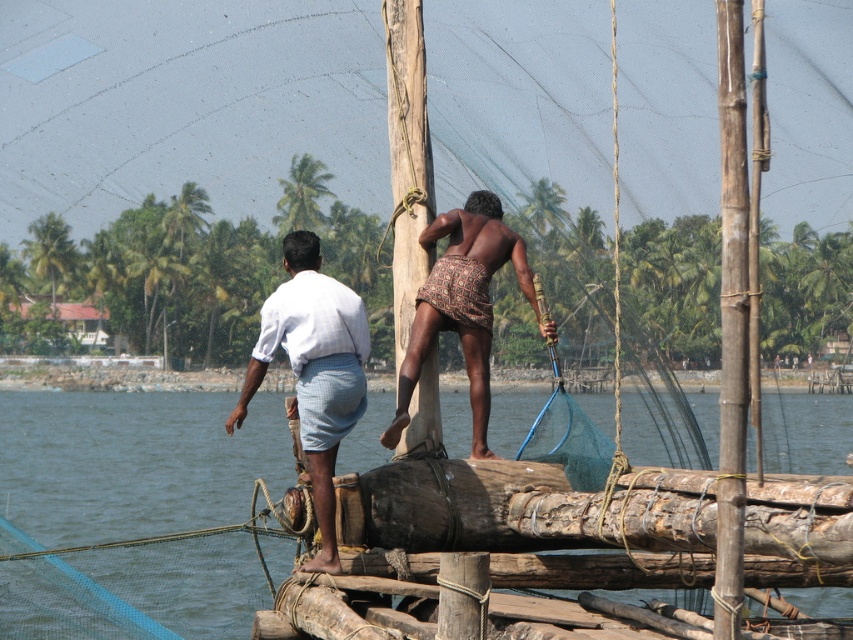
Question: Does transparent blue water at center have a greater width compared to brown woven cloth at center?

Choices:
 (A) no
 (B) yes

Answer: (B)

Question: Which point is farther to the camera?

Choices:
 (A) transparent blue water at center
 (B) brown woven cloth at center
 (C) brown bamboo pole at center

Answer: (A)

Question: Which of the following is the farthest from the observer?

Choices:
 (A) white checkered cloth at center
 (B) transparent blue water at center
 (C) brown bamboo pole at center

Answer: (B)

Question: Which of the following is the farthest from the observer?

Choices:
 (A) brown bamboo pole at center
 (B) white checkered cloth at center
 (C) transparent blue water at center
 (D) patterned fabric shorts at center

Answer: (C)

Question: Is white checkered cloth at center closer to camera compared to brown bamboo pole at center?

Choices:
 (A) yes
 (B) no

Answer: (B)

Question: Does brown woven cloth at center have a lesser width compared to brown bamboo pole at center?

Choices:
 (A) no
 (B) yes

Answer: (B)